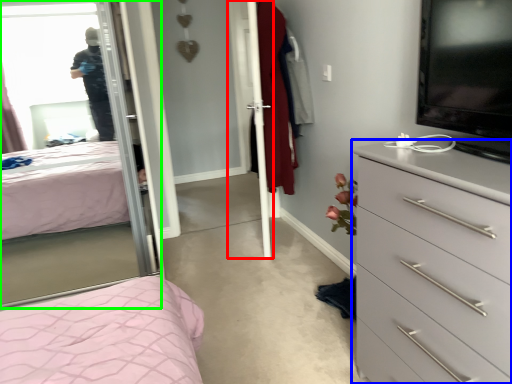
Question: Considering the real-world distances, which object is closest to screen door (highlighted by a red box)? chest of drawers (highlighted by a blue box) or mirror (highlighted by a green box).

Choices:
 (A) chest of drawers
 (B) mirror

Answer: (B)